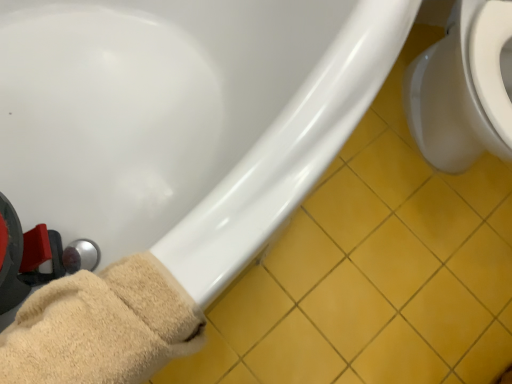
Question: Considering the positions of beige fuzzy towel at lower left and white glossy toilet at right in the image, is beige fuzzy towel at lower left wider or thinner than white glossy toilet at right?

Choices:
 (A) wide
 (B) thin

Answer: (B)

Question: Is beige fuzzy towel at lower left inside the boundaries of white glossy toilet at right, or outside?

Choices:
 (A) inside
 (B) outside

Answer: (B)

Question: Which object is positioned closest to the beige fuzzy towel at lower left?

Choices:
 (A) yellow tile at lower right
 (B) white glossy toilet at right
 (C) white glossy bathtub at lower left

Answer: (C)

Question: Which object is the closest to the white glossy bathtub at lower left?

Choices:
 (A) beige fuzzy towel at lower left
 (B) yellow tile at lower right
 (C) white glossy toilet at right

Answer: (A)